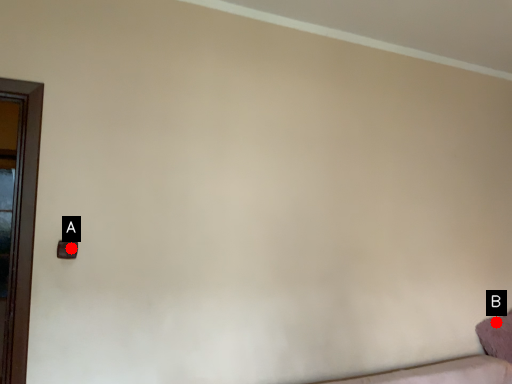
Question: Two points are circled on the image, labeled by A and B beside each circle. Which of the following is the closest to the observer?

Choices:
 (A) A is closer
 (B) B is closer

Answer: (A)